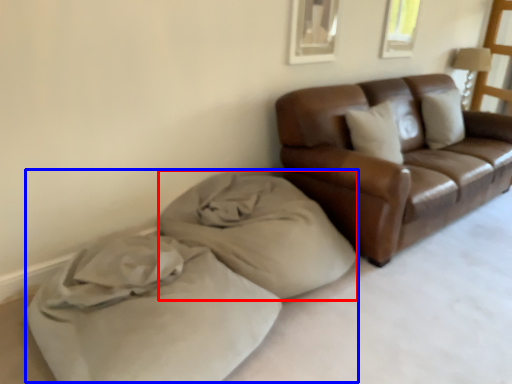
Question: Among these objects, which one is nearest to the camera, material (highlighted by a red box) or bed (highlighted by a blue box)?

Choices:
 (A) material
 (B) bed

Answer: (B)